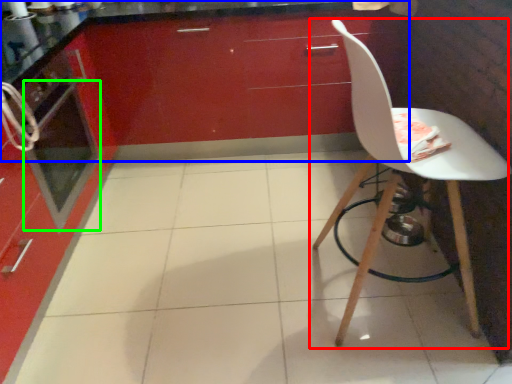
Question: Considering the real-world distances, which object is closest to chair (highlighted by a red box)? cabinetry (highlighted by a blue box) or oven (highlighted by a green box).

Choices:
 (A) cabinetry
 (B) oven

Answer: (A)